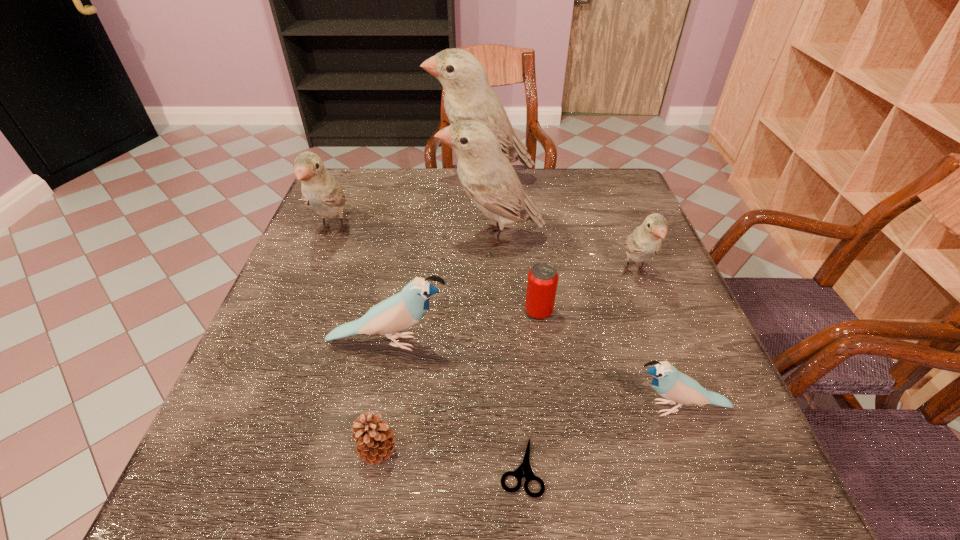
Locate an element on the screen. vacant space located 0.070m at the face of the eighth shortest object is located at coordinates (414, 236).

Find the location of a particular element. The image size is (960, 540). free location located at the face of the fourth shortest bird is located at coordinates (309, 295).

You are a GUI agent. You are given a task and a screenshot of the screen. Output one action in this format:
    pyautogui.click(x=<x>, y=<y>)
    Task: Click on the free space located at the face of the rightmost white bird
    The height and width of the screenshot is (540, 960).
    Given the screenshot: What is the action you would take?
    pyautogui.click(x=710, y=474)

Identify the location of vacant space located 0.100m at the face of the left blue bird. The image size is (960, 540). (500, 342).

Locate an element on the screen. This screenshot has width=960, height=540. vacant area situated 0.340m at the face of the nearest bird is located at coordinates point(429,408).

I want to click on vacant space situated 0.300m at the face of the nearest bird, so click(452, 408).

Identify the location of vacant space located 0.140m at the face of the nearest bird. This screenshot has height=540, width=960. (545, 408).

Where is `vacant space situated on the front of the can`? vacant space situated on the front of the can is located at coordinates (543, 349).

The height and width of the screenshot is (540, 960). What are the coordinates of `vacant space located 0.050m on the back of the pinecone` in the screenshot? It's located at (387, 404).

At what (x,y) coordinates should I click in order to perform the action: click on vacant area situated on the left of the shortest object. Please return your answer as a coordinate pair (x, y). The image size is (960, 540). Looking at the image, I should click on (300, 466).